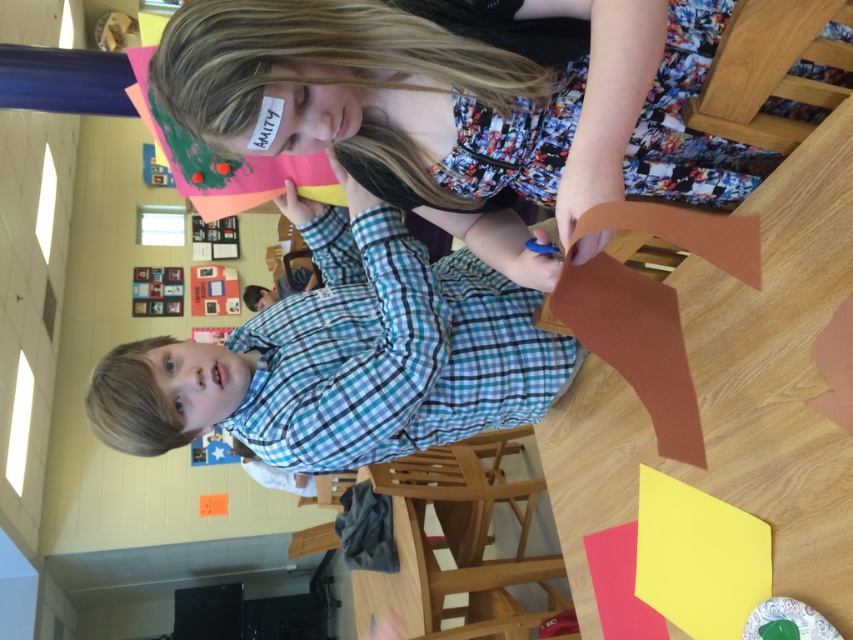
You are a student in the classroom and want to know which object is narrower between the matte paper at upper center and the matte plaid shirt at center. Can you tell me?

The matte paper at upper center has a lesser width compared to the matte plaid shirt at center, so the matte paper at upper center is narrower.

In the classroom scene, there are two objects labeled as matte paper at upper center and matte plaid shirt at center. Which object takes up more area in the image?

The matte plaid shirt at center takes up more area than the matte paper at upper center because the matte paper at upper center occupies less space than matte plaid shirt at center.

You are a teacher in the classroom and want to ensure that the children are following safety guidelines. According to the image provided, is the distance between the matte paper at upper center and the matte plaid shirt at center sufficient to prevent any potential hazards from the craft materials?

The matte paper at upper center and the matte plaid shirt at center are 15.12 inches apart from each other, which is a safe distance to prevent any potential hazards from the craft materials.